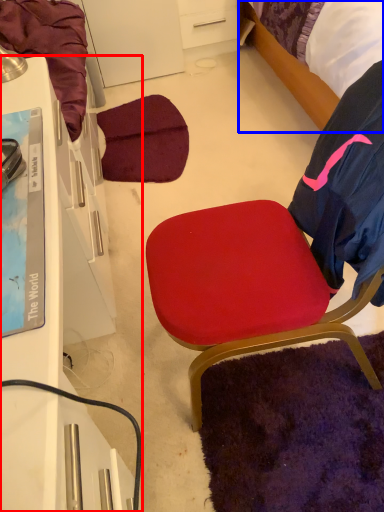
Question: Which object is closer to the camera taking this photo, desk (highlighted by a red box) or bed (highlighted by a blue box)?

Choices:
 (A) desk
 (B) bed

Answer: (A)